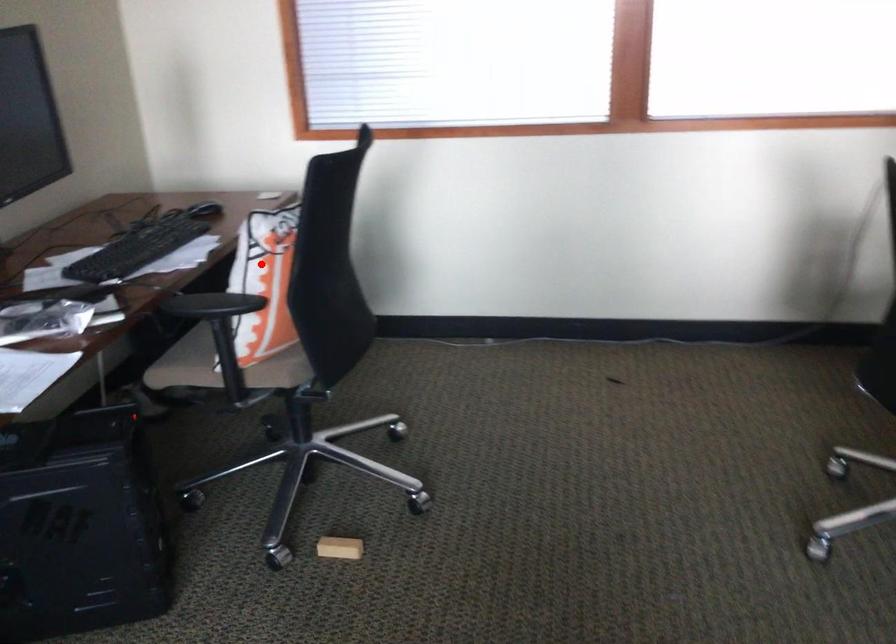
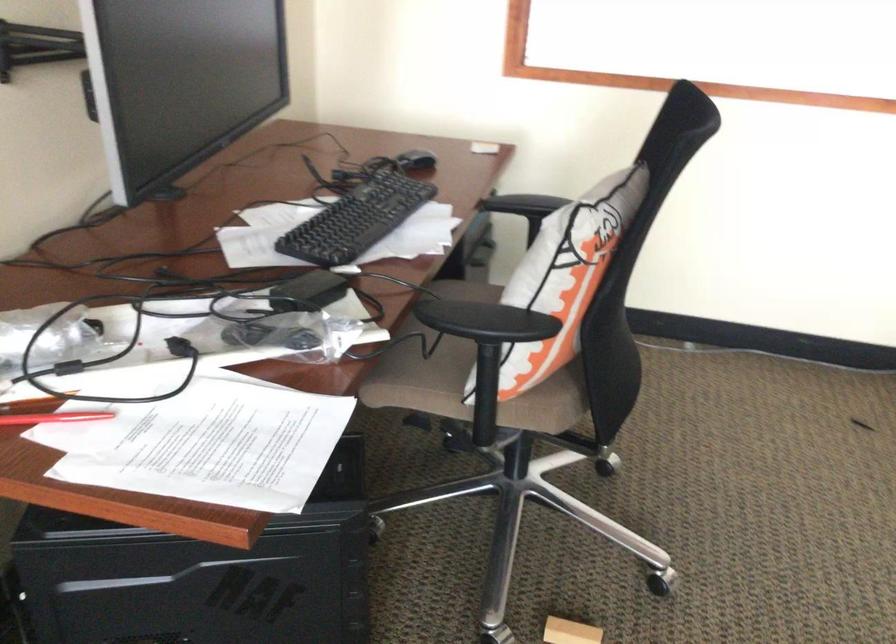
Where in the second image is the point corresponding to the highlighted location from the first image?

(564, 277)